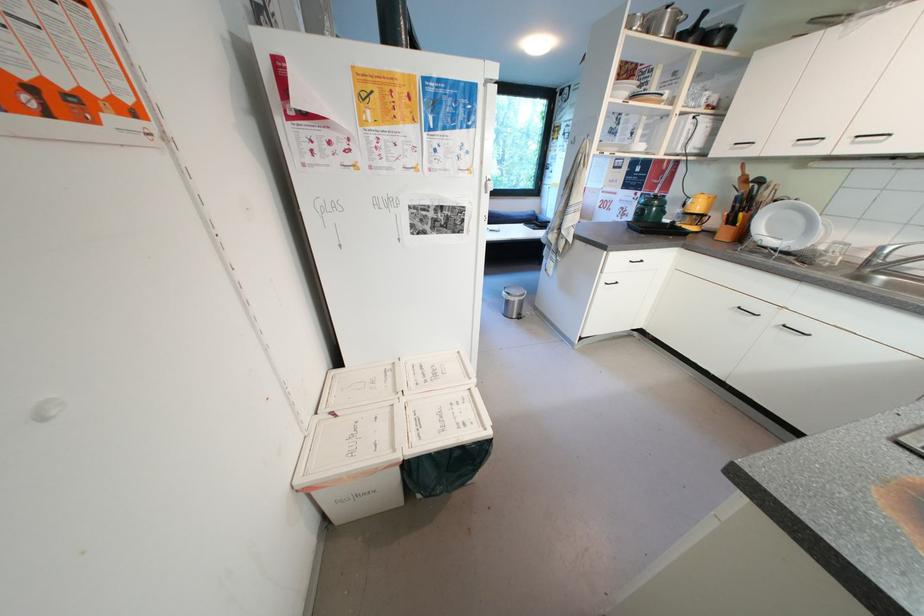
Which object does [513,301] point to?

It corresponds to the metal trash can in the image.